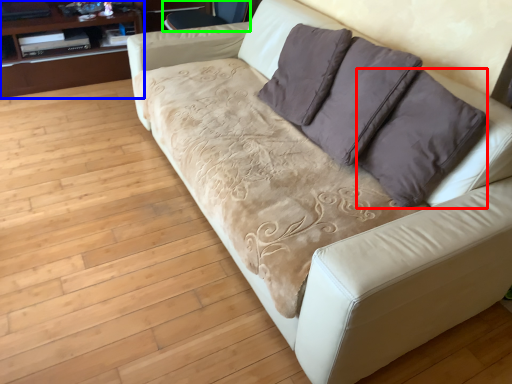
Question: Estimate the real-world distances between objects in this image. Which object is farther from throw pillow (highlighted by a red box), dresser (highlighted by a blue box) or armchair (highlighted by a green box)?

Choices:
 (A) dresser
 (B) armchair

Answer: (A)